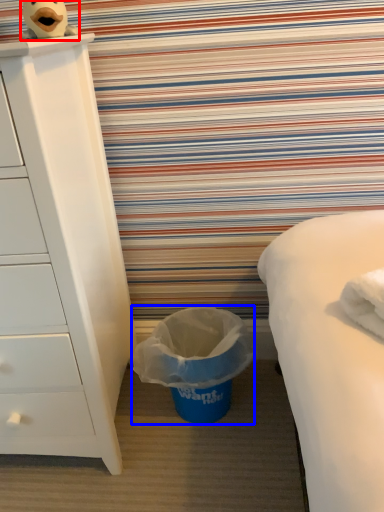
Question: Which point is further to the camera, toy (highlighted by a red box) or garbage (highlighted by a blue box)?

Choices:
 (A) toy
 (B) garbage

Answer: (B)